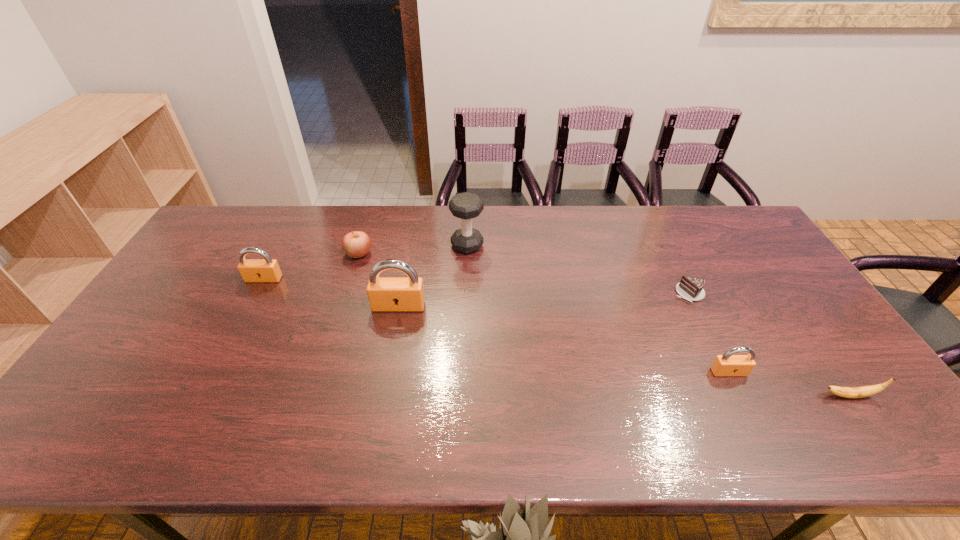
Select which object appears as the fourth closest to the apple. Please provide its 2D coordinates. Your answer should be formatted as a tuple, i.e. [(x, y)], where the tuple contains the x and y coordinates of a point satisfying the conditions above.

[(690, 288)]

Where is `padlock that is the closest to the second nearest object`? Image resolution: width=960 pixels, height=540 pixels. padlock that is the closest to the second nearest object is located at coordinates (386, 294).

Image resolution: width=960 pixels, height=540 pixels. Find the location of `padlock object that ranks as the second closest to the second object from left to right`. padlock object that ranks as the second closest to the second object from left to right is located at coordinates (267, 269).

Find the location of `vacant point that satisfies the following two spatial constraints: 1. to unlock the farthest padlock from the front; 2. on the left side of the chocolate cake`. vacant point that satisfies the following two spatial constraints: 1. to unlock the farthest padlock from the front; 2. on the left side of the chocolate cake is located at coordinates (256, 293).